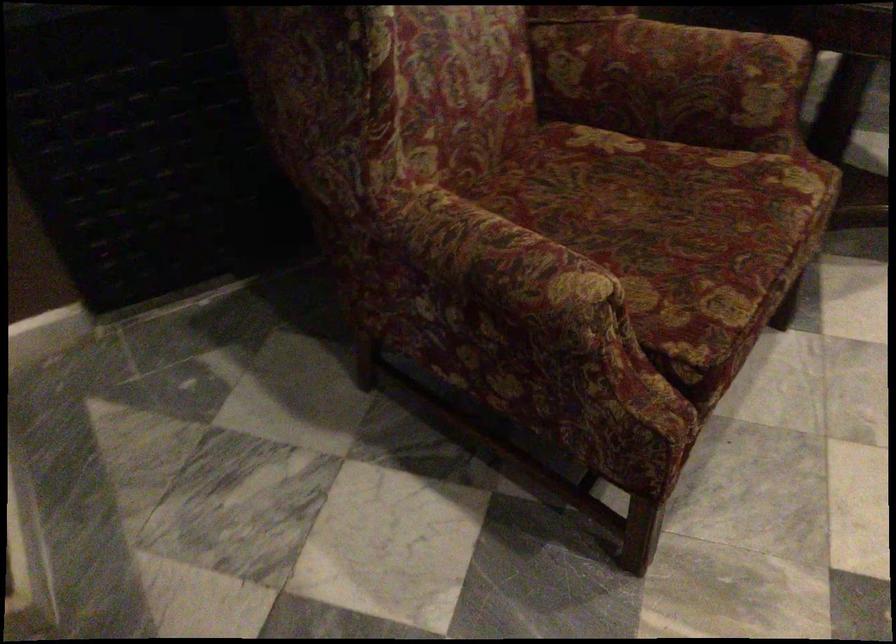
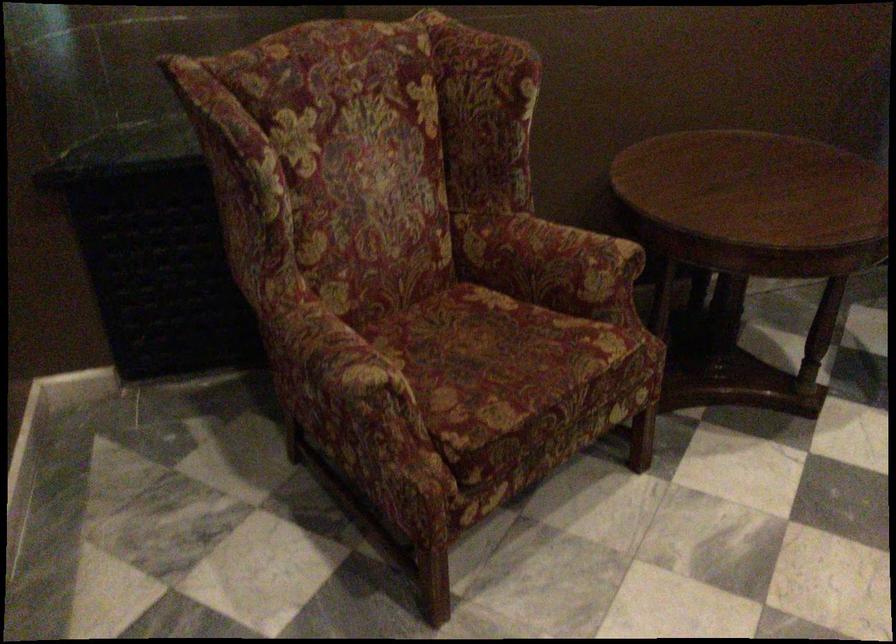
The point at (549, 315) is marked in the first image. Where is the corresponding point in the second image?

(343, 389)